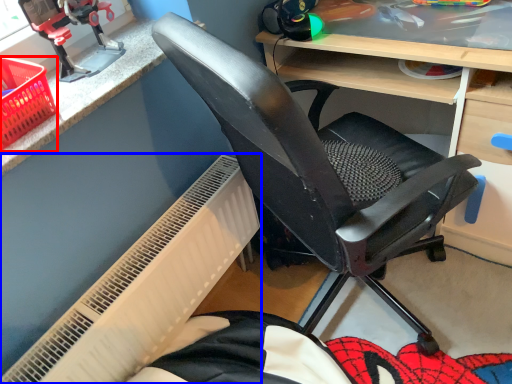
Question: Which point is further to the camera, basket (highlighted by a red box) or radiator (highlighted by a blue box)?

Choices:
 (A) basket
 (B) radiator

Answer: (B)